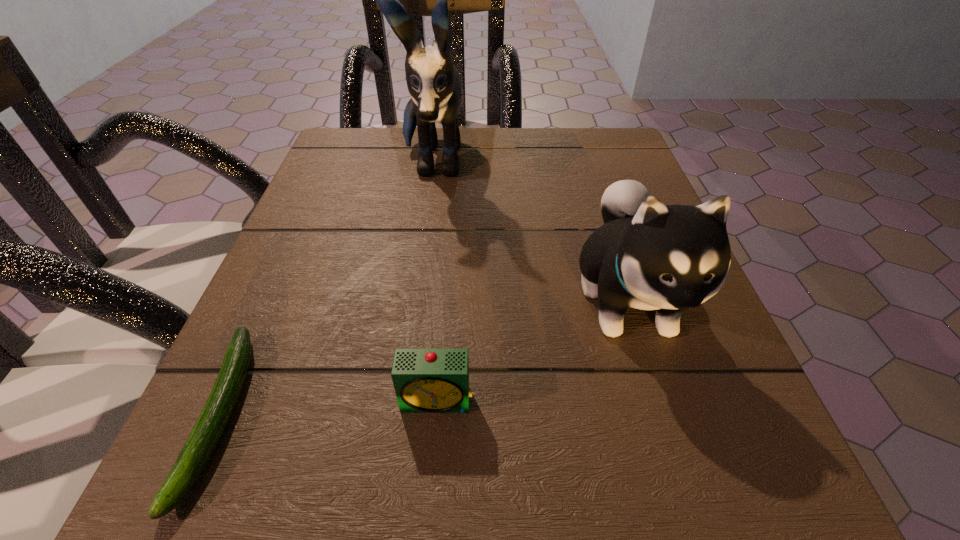
What are the coordinates of `object that is positioned at the near edge` in the screenshot? It's located at (208, 429).

You are a GUI agent. You are given a task and a screenshot of the screen. Output one action in this format:
    pyautogui.click(x=<x>, y=<y>)
    Task: Click on the object at the left edge
    The height and width of the screenshot is (540, 960).
    Given the screenshot: What is the action you would take?
    pos(208,429)

You are a GUI agent. You are given a task and a screenshot of the screen. Output one action in this format:
    pyautogui.click(x=<x>, y=<y>)
    Task: Click on the object situated at the right edge
    Image resolution: width=960 pixels, height=540 pixels.
    Given the screenshot: What is the action you would take?
    pyautogui.click(x=649, y=256)

You are a GUI agent. You are given a task and a screenshot of the screen. Output one action in this format:
    pyautogui.click(x=<x>, y=<y>)
    Task: Click on the object at the near left corner
    Image resolution: width=960 pixels, height=540 pixels.
    Given the screenshot: What is the action you would take?
    pyautogui.click(x=208, y=429)

Locate an element on the screen. The width and height of the screenshot is (960, 540). vacant space at the far edge of the desktop is located at coordinates (465, 171).

Image resolution: width=960 pixels, height=540 pixels. In the image, there is a desktop. Identify the location of free space at the near edge. (607, 512).

Image resolution: width=960 pixels, height=540 pixels. Identify the location of free space at the left edge of the desktop. (324, 267).

You are a GUI agent. You are given a task and a screenshot of the screen. Output one action in this format:
    pyautogui.click(x=<x>, y=<y>)
    Task: Click on the vacant space at the right edge of the desktop
    The width and height of the screenshot is (960, 540).
    Given the screenshot: What is the action you would take?
    pyautogui.click(x=585, y=206)

In the image, there is a desktop. Identify the location of vacant space at the far left corner. (396, 143).

Locate an element on the screen. vacant position at the near left corner of the desktop is located at coordinates (256, 486).